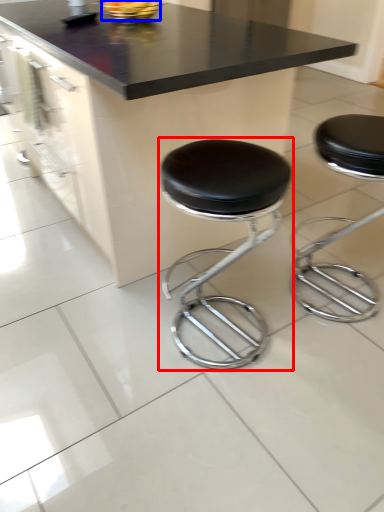
Question: Which object is closer to the camera taking this photo, stool (highlighted by a red box) or food (highlighted by a blue box)?

Choices:
 (A) stool
 (B) food

Answer: (A)